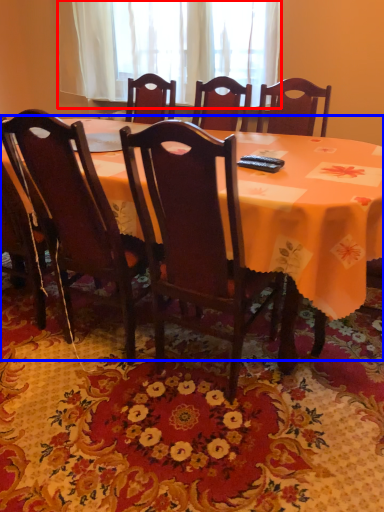
Question: Which of the following is the farthest to the observer, curtain (highlighted by a red box) or table (highlighted by a blue box)?

Choices:
 (A) curtain
 (B) table

Answer: (A)